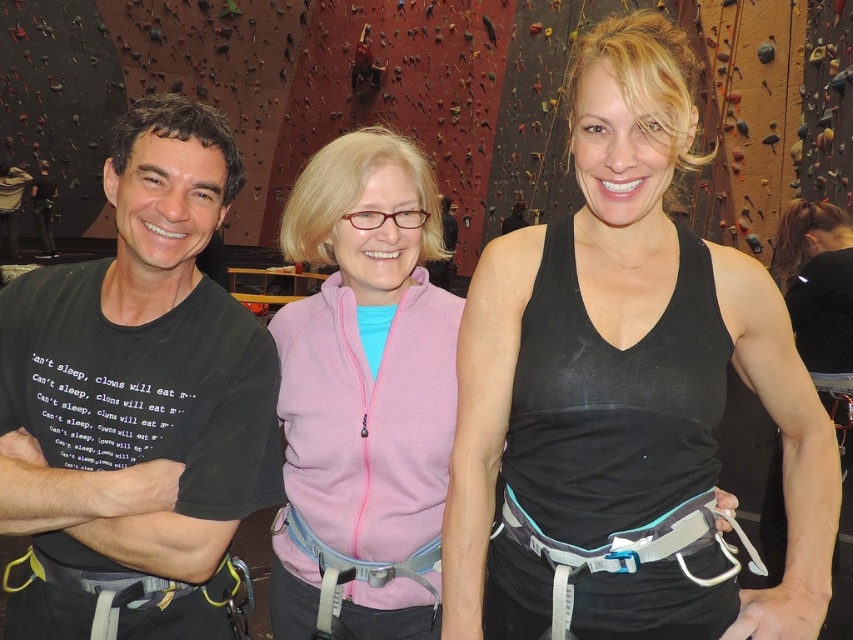
Is black matte t-shirt at left smaller than black t-shirt at left?

Yes.

Can you confirm if black matte t-shirt at left is wider than black t-shirt at left?

No.

Find the location of a particular element. black matte t-shirt at left is located at coordinates (137, 401).

Between black matte tank top at center and black t-shirt at left, which one is positioned higher?

black t-shirt at left

Is black matte tank top at center below black t-shirt at left?

Correct, black matte tank top at center is located below black t-shirt at left.

Identify the location of black matte tank top at center. click(x=624, y=380).

Consider the image. Does black matte tank top at center appear on the left side of black matte t-shirt at left?

No, black matte tank top at center is not to the left of black matte t-shirt at left.

Which is behind, point (544, 477) or point (45, 404)?

Positioned behind is point (45, 404).

Is point (602, 323) closer to viewer compared to point (206, 564)?

That is True.

At what (x,y) coordinates should I click in order to perform the action: click on black matte tank top at center. Please return your answer as a coordinate pair (x, y). Image resolution: width=853 pixels, height=640 pixels. Looking at the image, I should click on (624, 380).